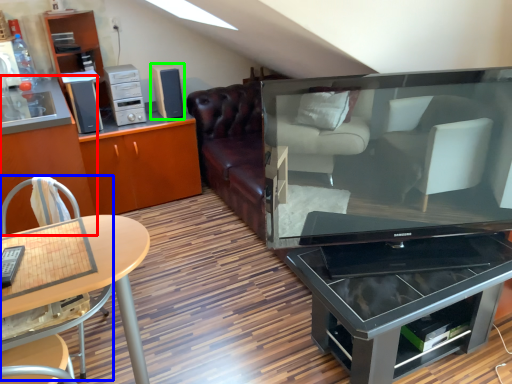
Question: Which object is the farthest from cabinetry (highlighted by a red box)? Choose among these: chair (highlighted by a blue box) or speaker (highlighted by a green box).

Choices:
 (A) chair
 (B) speaker

Answer: (B)